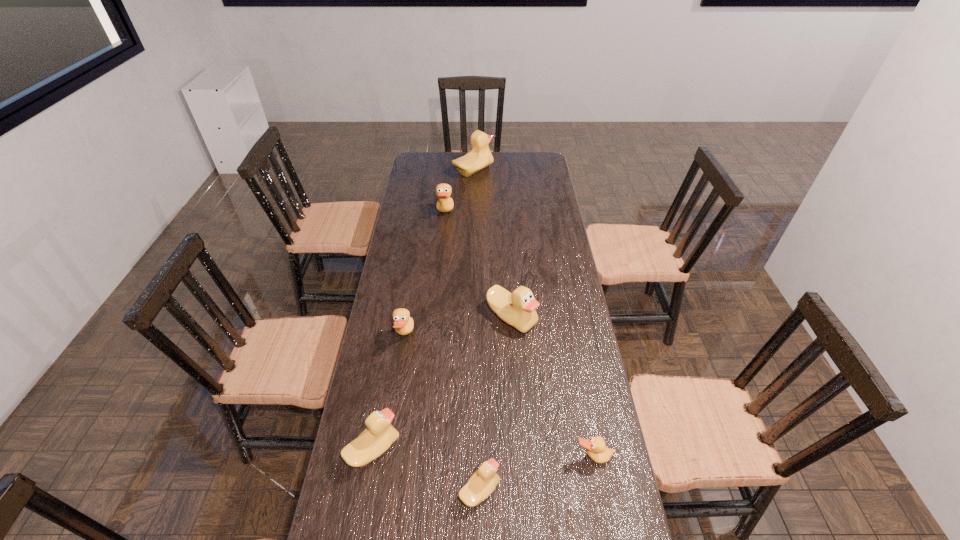
At what (x,y) coordinates should I click in order to perform the action: click on the rightmost tan duck. Please return your answer as a coordinate pair (x, y). This screenshot has height=540, width=960. Looking at the image, I should click on (596, 449).

The width and height of the screenshot is (960, 540). I want to click on free space located 0.070m at the beak of the farthest object, so 507,171.

Identify the location of free spot located 0.100m at the beak of the third nearest beige duck. The height and width of the screenshot is (540, 960). (515, 362).

Find the location of a particular element. vacant area situated on the beak of the second tan duck from left to right is located at coordinates (501, 213).

This screenshot has width=960, height=540. I want to click on vacant area situated 0.110m at the beak of the third biggest beige duck, so click(439, 449).

Where is `vacant space positioned 0.300m on the beak of the second farthest tan duck`? This screenshot has width=960, height=540. vacant space positioned 0.300m on the beak of the second farthest tan duck is located at coordinates (501, 335).

You are a GUI agent. You are given a task and a screenshot of the screen. Output one action in this format:
    pyautogui.click(x=<x>, y=<y>)
    Task: Click on the free location located at the beak of the smallest beige duck
    The width and height of the screenshot is (960, 540).
    Given the screenshot: What is the action you would take?
    pyautogui.click(x=581, y=490)

The height and width of the screenshot is (540, 960). In order to click on free location located on the beak of the smallest tan duck in this screenshot , I will do `click(601, 501)`.

Locate an element on the screen. The image size is (960, 540). object situated at the far edge is located at coordinates coord(480,157).

You are a GUI agent. You are given a task and a screenshot of the screen. Output one action in this format:
    pyautogui.click(x=<x>, y=<y>)
    Task: Click on the object located in the right edge section of the desktop
    The height and width of the screenshot is (540, 960).
    Given the screenshot: What is the action you would take?
    pyautogui.click(x=596, y=449)